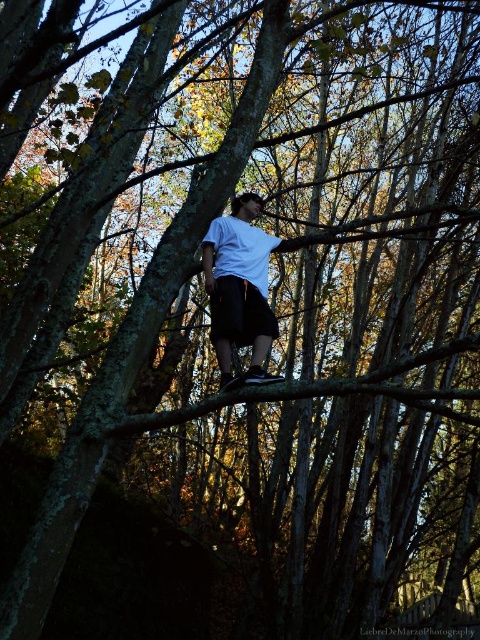
Question: Does white matte shirt at center have a larger size compared to black matte shorts at center?

Choices:
 (A) yes
 (B) no

Answer: (A)

Question: Which object is closer to the camera taking this photo?

Choices:
 (A) white matte shirt at center
 (B) black matte shorts at center

Answer: (A)

Question: In this image, where is white matte shirt at center located relative to black matte shorts at center?

Choices:
 (A) below
 (B) above

Answer: (B)

Question: Can you confirm if white matte shirt at center is positioned to the left of black matte shorts at center?

Choices:
 (A) no
 (B) yes

Answer: (B)

Question: Which point is closer to the camera?

Choices:
 (A) black matte shorts at center
 (B) white matte shirt at center

Answer: (B)

Question: Among these objects, which one is farthest from the camera?

Choices:
 (A) black matte shorts at center
 (B) white matte shirt at center

Answer: (A)